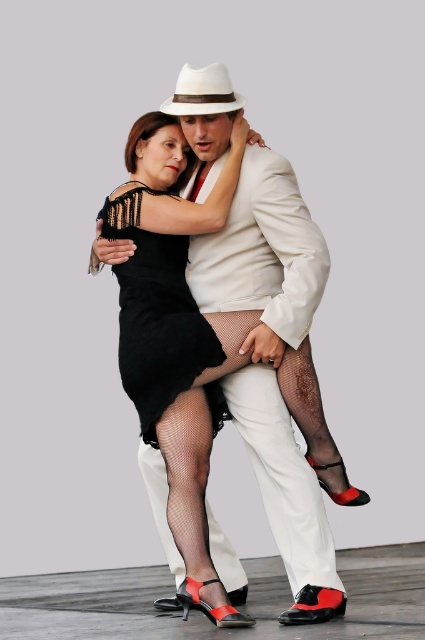
You are a photographer taking a picture of the dance duo. You notice both the fishnet stockings at center and the black mesh dress at center. Which one appears larger in the photo?

The fishnet stockings at center appears larger in the photo because it is bigger than the black mesh dress at center.

You are a photographer trying to capture a closeup shot of both the black mesh dress at center and the white felt fedora at center in the dance scene. Your camera has a maximum focus range of 1 meter. Can you fit both objects within the camera frame without moving the camera?

The black mesh dress at center and white felt fedora at center are 1.08 meters apart from each other. Since the distance between them exceeds the camera maximum focus range of 1 meter, you cannot fit both objects within the camera frame without moving the camera.